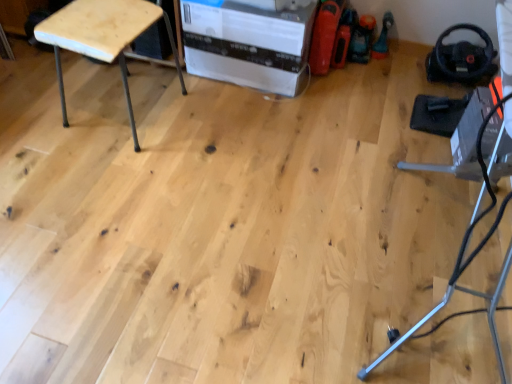
This screenshot has height=384, width=512. I want to click on free spot below natural wood stool at upper left (from a real-world perspective), so click(x=129, y=118).